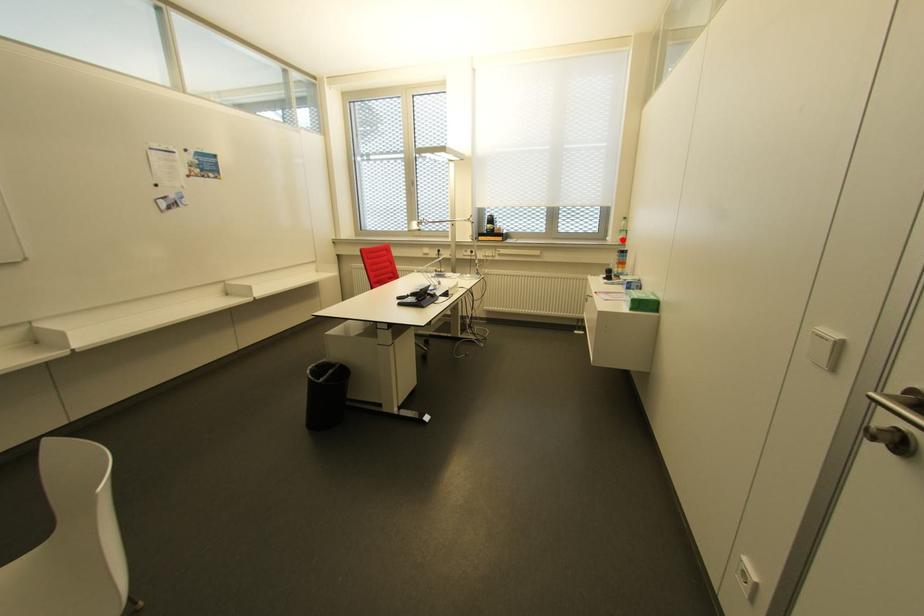
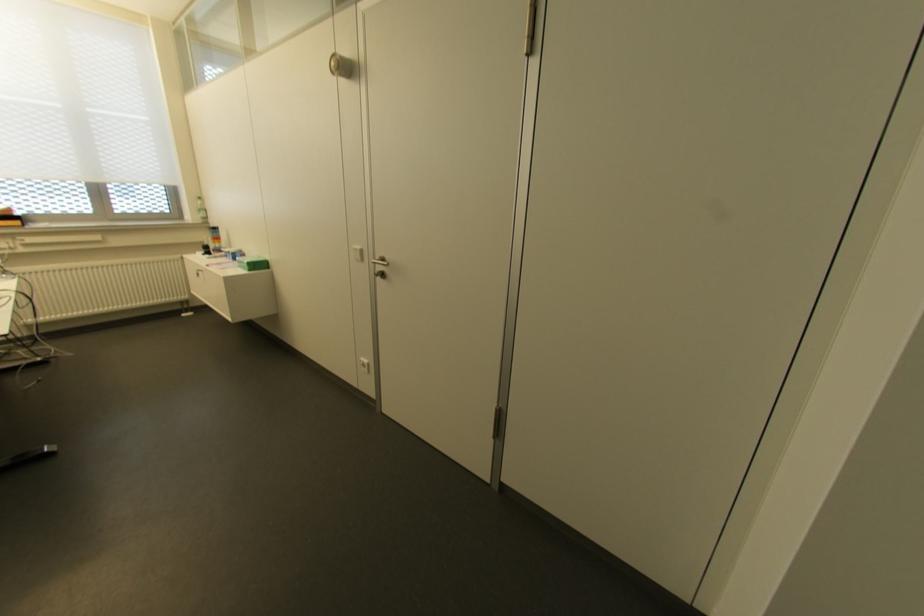
Where in the second image is the point corresponding to the highlighted location from the first image?

(204, 217)